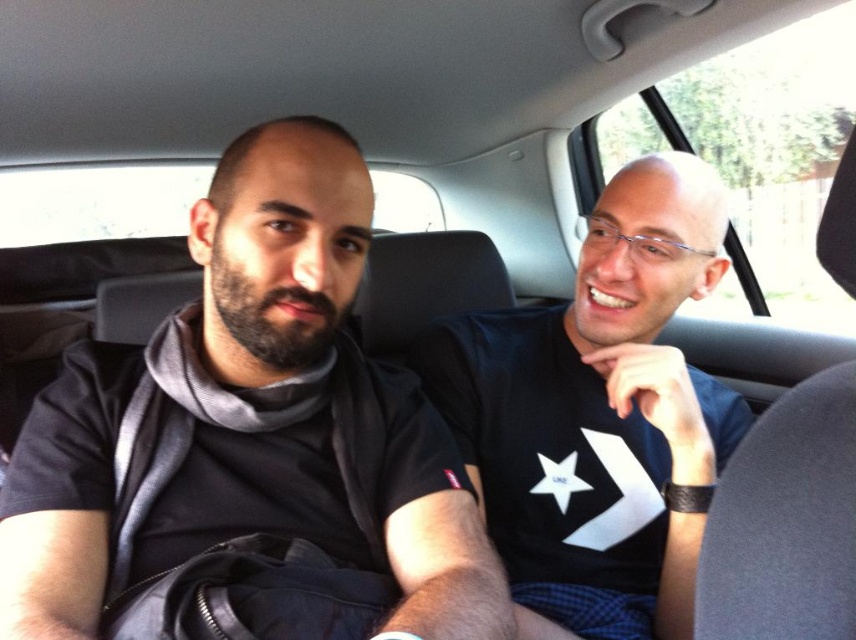
Who is more forward, [242,481] or [777,442]?

Point [777,442] is more forward.

Which is in front, point (418, 497) or point (712, 502)?

Positioned in front is point (712, 502).

Image resolution: width=856 pixels, height=640 pixels. I want to click on black matte t-shirt at left, so click(x=308, y=394).

Does blue fabric shirt at center have a greater height compared to black leather seat at center?

Indeed, blue fabric shirt at center has a greater height compared to black leather seat at center.

Does blue fabric shirt at center appear on the right side of black leather seat at center?

No, blue fabric shirt at center is not to the right of black leather seat at center.

The width and height of the screenshot is (856, 640). What do you see at coordinates (599, 416) in the screenshot? I see `blue fabric shirt at center` at bounding box center [599, 416].

This screenshot has width=856, height=640. I want to click on blue fabric shirt at center, so click(x=599, y=416).

Can you confirm if black matte t-shirt at left is positioned to the right of blue fabric shirt at center?

In fact, black matte t-shirt at left is to the left of blue fabric shirt at center.

This screenshot has width=856, height=640. Identify the location of black matte t-shirt at left. (308, 394).

The image size is (856, 640). I want to click on black matte t-shirt at left, so click(308, 394).